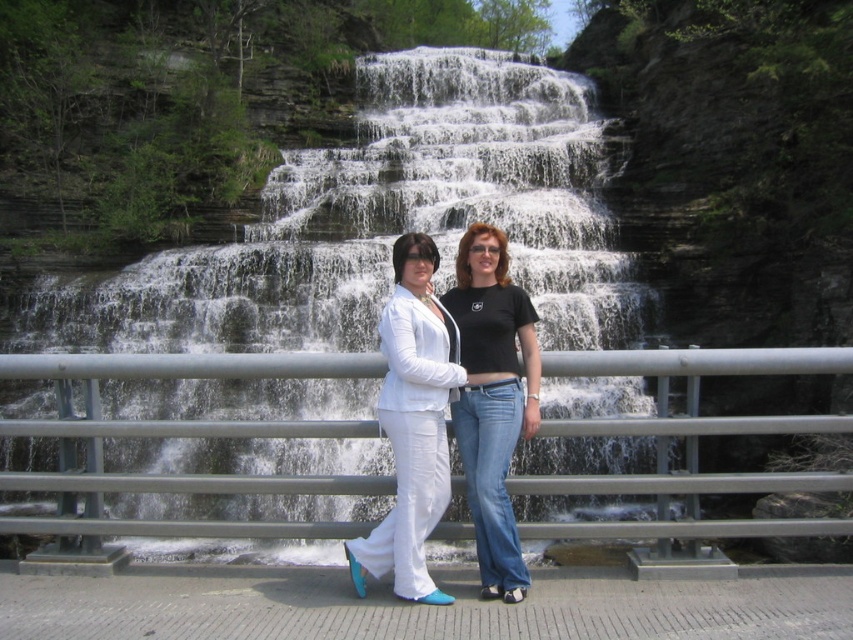
Can you confirm if white textured water at center is positioned to the right of matte white pants at center?

Incorrect, white textured water at center is not on the right side of matte white pants at center.

Is white textured water at center further to camera compared to matte white pants at center?

That is True.

Is point (527, 268) closer to camera compared to point (444, 458)?

No, it is not.

What are the coordinates of `white textured water at center` in the screenshot? It's located at (381, 225).

Can you confirm if metallic gray railing at center is taller than matte white pants at center?

Yes, metallic gray railing at center is taller than matte white pants at center.

The height and width of the screenshot is (640, 853). I want to click on metallic gray railing at center, so click(x=177, y=436).

Who is more forward, (509, 128) or (103, 364)?

Point (103, 364) is in front.

Does white textured water at center come behind metallic gray railing at center?

Yes, white textured water at center is behind metallic gray railing at center.

Is point (352, 244) positioned after point (660, 388)?

Yes, it is behind point (660, 388).

Find the location of a particular element. The height and width of the screenshot is (640, 853). white textured water at center is located at coordinates (381, 225).